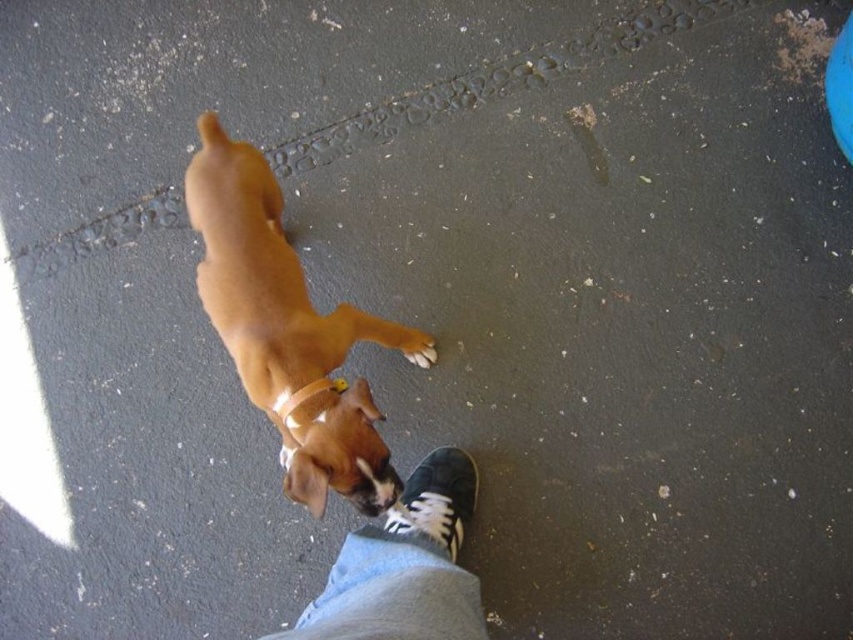
Consider the image. Can you confirm if brown leather dog at center is smaller than brown fur paw at lower center?

No.

Does brown leather dog at center have a lesser height compared to brown fur paw at lower center?

In fact, brown leather dog at center may be taller than brown fur paw at lower center.

Measure the distance between point (256, 218) and camera.

The distance of point (256, 218) from camera is 1.53 meters.

You are a GUI agent. You are given a task and a screenshot of the screen. Output one action in this format:
    pyautogui.click(x=<x>, y=<y>)
    Task: Click on the brown leather dog at center
    The width and height of the screenshot is (853, 640).
    Given the screenshot: What is the action you would take?
    pyautogui.click(x=285, y=330)

Which is behind, point (227, 294) or point (422, 493)?

The point (422, 493) is more distant.

Does brown leather dog at center have a lesser height compared to white leather shoe at center?

Incorrect, brown leather dog at center's height does not fall short of white leather shoe at center's.

Between point (303, 362) and point (426, 506), which one is positioned in front?

Point (303, 362) is in front.

Identify the location of brown leather dog at center. This screenshot has height=640, width=853. (285, 330).

Who is shorter, white leather shoe at center or brown fur paw at lower center?

brown fur paw at lower center is shorter.

Does white leather shoe at center appear on the left side of brown fur paw at lower center?

No, white leather shoe at center is not to the left of brown fur paw at lower center.

Which is in front, point (431, 474) or point (418, 360)?

Point (431, 474) is more forward.

Identify the location of white leather shoe at center. (437, 499).